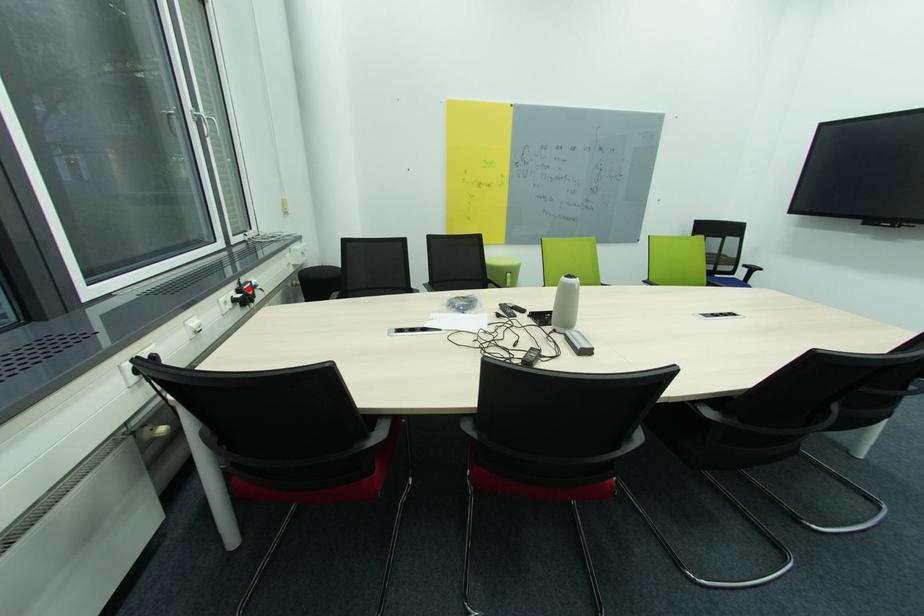
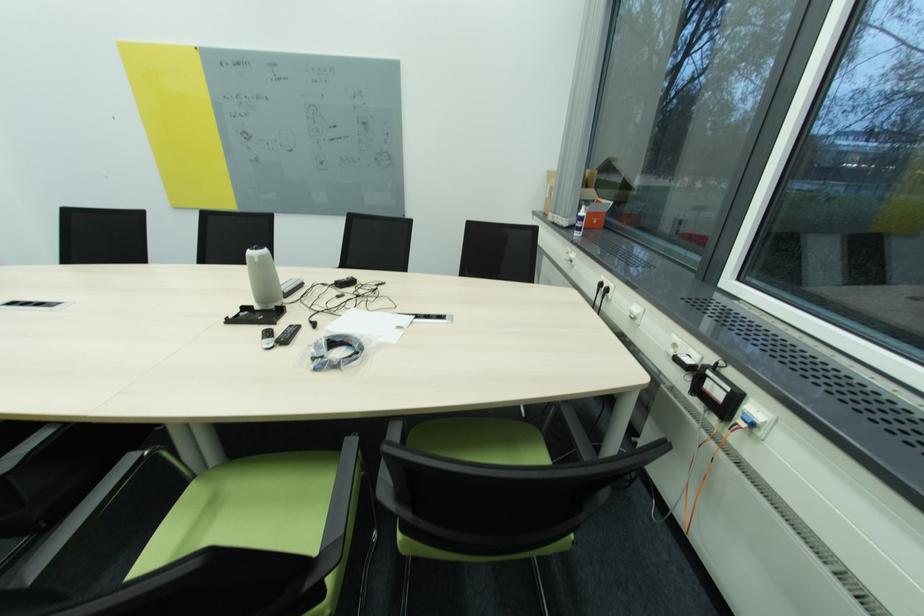
Question: I am providing you with two images of the same scene from different viewpoints. Image1 has a red point marked. In image2, the corresponding 3D location appears at what relative position? Reply with the corresponding letter.

Choices:
 (A) Closer
 (B) Farther

Answer: (B)